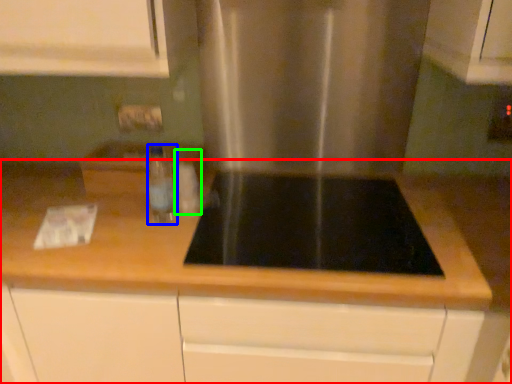
Question: Which object is the closest to the countertop (highlighted by a red box)? Choose among these: bottle (highlighted by a blue box) or bottle (highlighted by a green box).

Choices:
 (A) bottle
 (B) bottle

Answer: (A)